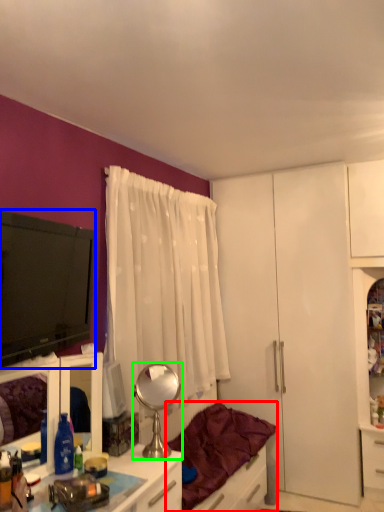
Question: Based on their relative distances, which object is farther from studio couch (highlighted by a red box)? Choose from television (highlighted by a blue box) and mirror (highlighted by a green box).

Choices:
 (A) television
 (B) mirror

Answer: (A)